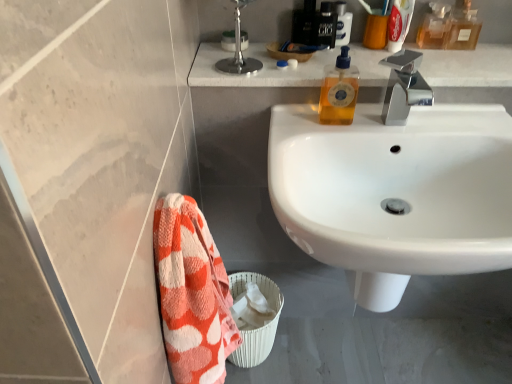
This screenshot has width=512, height=384. Identify the location of free space in front of translucent plastic mouthwash at upper center, marked as the 1th mouthwash in a left-to-right arrangement. (384, 64).